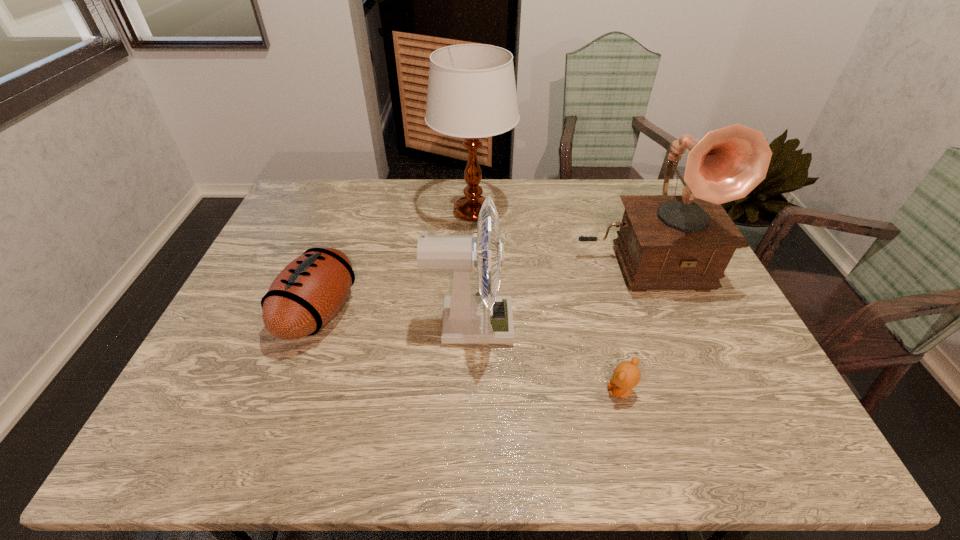
Image resolution: width=960 pixels, height=540 pixels. In the image, there is a desktop. Find the location of `vacant region at the near left corner`. vacant region at the near left corner is located at coordinates (201, 434).

The width and height of the screenshot is (960, 540). Identify the location of free space at the near right corner of the desktop. (760, 424).

Locate an element on the screen. This screenshot has width=960, height=540. unoccupied position between the teddy bear and the table lamp is located at coordinates (547, 302).

I want to click on vacant space in between the leftmost object and the table lamp, so click(x=396, y=262).

Image resolution: width=960 pixels, height=540 pixels. What are the coordinates of `vacant area that lies between the shortest object and the table lamp` in the screenshot? It's located at (547, 302).

I want to click on free space between the fourth tallest object and the table lamp, so 396,262.

The width and height of the screenshot is (960, 540). I want to click on empty space between the record player and the fan, so click(x=555, y=292).

The image size is (960, 540). I want to click on vacant point located between the table lamp and the record player, so (556, 236).

Identify the location of free space between the shortest object and the table lamp. This screenshot has width=960, height=540. (547, 302).

The width and height of the screenshot is (960, 540). I want to click on vacant space that is in between the third tallest object and the football (American), so click(x=394, y=319).